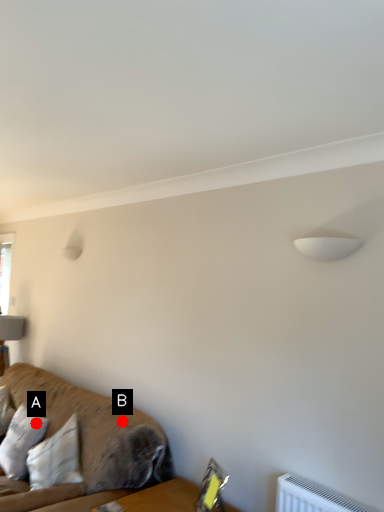
Question: Two points are circled on the image, labeled by A and B beside each circle. Among these points, which one is farthest from the camera?

Choices:
 (A) A is further
 (B) B is further

Answer: (A)